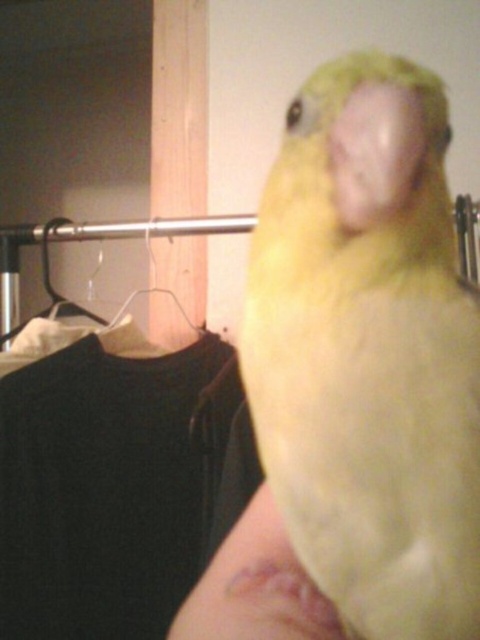
Question: Among these objects, which one is nearest to the camera?

Choices:
 (A) pink flesh at center
 (B) yellow matte parrot at center

Answer: (B)

Question: Does yellow matte parrot at center have a greater width compared to pink flesh at center?

Choices:
 (A) yes
 (B) no

Answer: (A)

Question: Can you confirm if yellow matte parrot at center is positioned to the right of pink flesh at center?

Choices:
 (A) no
 (B) yes

Answer: (B)

Question: Does yellow matte parrot at center have a greater width compared to pink flesh at center?

Choices:
 (A) yes
 (B) no

Answer: (A)

Question: Which point is closer to the camera?

Choices:
 (A) (337, 296)
 (B) (292, 609)

Answer: (A)